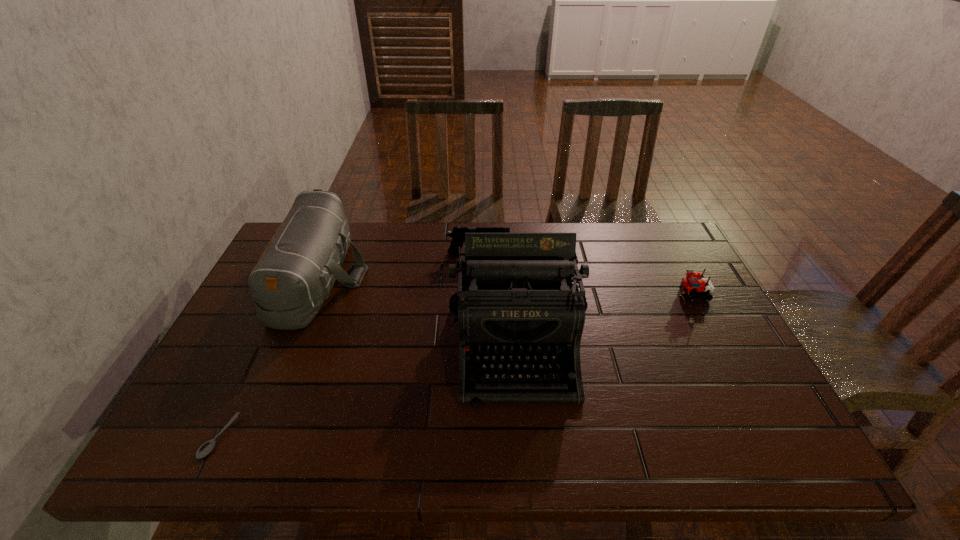
Image resolution: width=960 pixels, height=540 pixels. What are the coordinates of `the tallest object` in the screenshot? It's located at tap(514, 300).

I want to click on the fourth shortest object, so click(294, 275).

Find the location of `gun`. gun is located at coordinates (458, 233).

This screenshot has width=960, height=540. What are the coordinates of `Lego` in the screenshot? It's located at (690, 284).

The image size is (960, 540). I want to click on the fourth tallest object, so click(x=690, y=284).

In order to click on soupspoon in this screenshot , I will do `click(207, 447)`.

Locate an element on the screen. The height and width of the screenshot is (540, 960). the shortest object is located at coordinates (207, 447).

Where is `free spot located 0.100m on the keyboard of the typewriter`? free spot located 0.100m on the keyboard of the typewriter is located at coordinates (524, 453).

This screenshot has width=960, height=540. In order to click on free point located 0.340m on the right of the duffel bag in this screenshot , I will do `click(478, 276)`.

You are a GUI agent. You are given a task and a screenshot of the screen. Output one action in this format:
    pyautogui.click(x=<x>, y=<y>)
    Task: Click on the vacant space located at the aiming end of the third shortest object
    The image size is (960, 540).
    Given the screenshot: What is the action you would take?
    pyautogui.click(x=595, y=253)